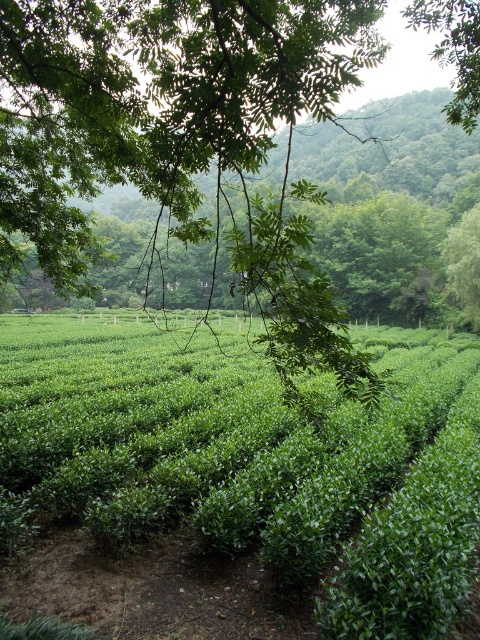
You are a photographer standing in the tea plantation and want to capture both the point at coordinates point (250, 436) and point (216, 125) in your photo. Which point will appear closer to the edges of your camera frame?

Point (216, 125) will appear closer to the edges of your camera frame because it is closer to the camera than point (250, 436), which is further away.

You are a landscape designer assessing the tea plantation. You notice the green leafy hedge at center and the green leafy tree at upper left. Which of these two has a larger size?

The green leafy tree at upper left is larger than the green leafy hedge at center.

You are a landscape architect designing a garden path that needs to pass between the green leafy hedge at center and the green leafy tree at upper left. Based on their positions, which object should the path be closer to in order to maintain a natural flow?

The path should be closer to the green leafy tree at upper left because the green leafy hedge at center is closer to the viewer, so positioning the path nearer to the tree would create a more natural and balanced flow through the space.